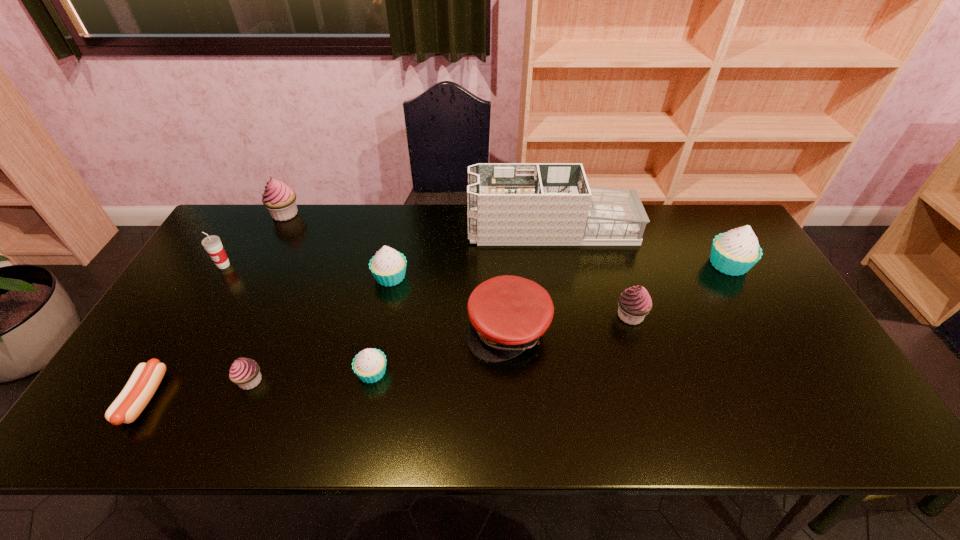
In order to click on empty location between the tallest object and the cup in this screenshot , I will do `click(388, 247)`.

You are a GUI agent. You are given a task and a screenshot of the screen. Output one action in this format:
    pyautogui.click(x=<x>, y=<y>)
    Task: Click on the free space between the farthest pink cupcake and the rightmost pink cupcake
    The height and width of the screenshot is (540, 960).
    Given the screenshot: What is the action you would take?
    pyautogui.click(x=458, y=265)

Where is `vacant space that's between the leftmost pink cupcake and the fifth cupcake from left to right`? vacant space that's between the leftmost pink cupcake and the fifth cupcake from left to right is located at coordinates (458, 265).

The image size is (960, 540). Identify the location of vacant point located between the red cap and the smallest white cupcake. (440, 350).

Image resolution: width=960 pixels, height=540 pixels. I want to click on vacant space in between the second biggest pink cupcake and the sausage, so click(x=387, y=357).

Find the location of a particular element. vacant space in between the sausage and the second biggest white cupcake is located at coordinates (268, 338).

Find the location of a particular element. This screenshot has height=540, width=960. the ninth closest object to the dollhouse is located at coordinates click(144, 381).

Find the location of a particular element. object that ranks as the fifth closest to the second biggest white cupcake is located at coordinates (280, 199).

Find the location of a particular element. This screenshot has height=540, width=960. cupcake identified as the fifth closest to the second biggest white cupcake is located at coordinates (735, 252).

Where is `cupcake that is the closest to the leftmost pink cupcake`? Image resolution: width=960 pixels, height=540 pixels. cupcake that is the closest to the leftmost pink cupcake is located at coordinates (388, 266).